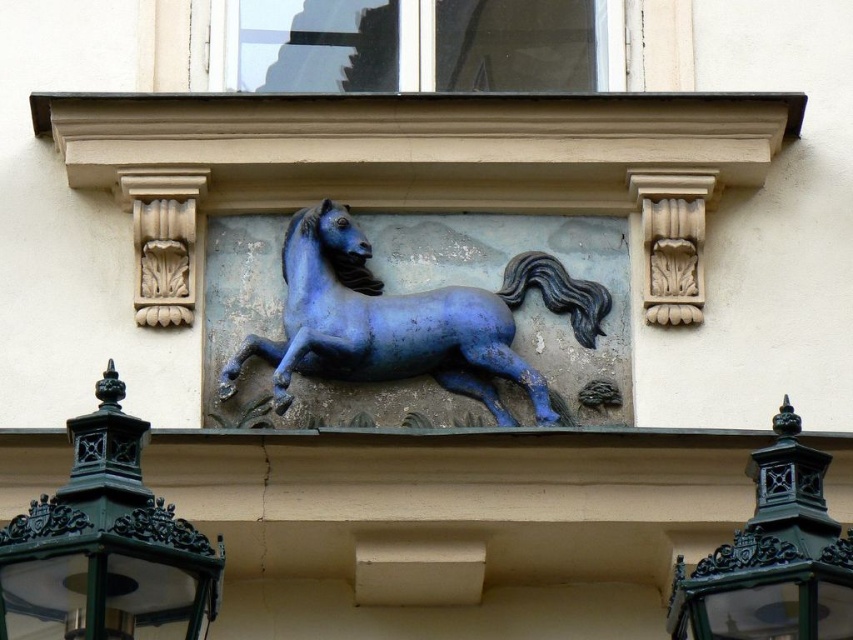
Question: Among these objects, which one is farthest from the camera?

Choices:
 (A) green cast iron lamp at lower left
 (B) glossy blue horse at center

Answer: (B)

Question: Which of the following is the closest to the observer?

Choices:
 (A) glossy blue horse at center
 (B) green cast iron lamp at lower left
 (C) green cast iron lantern at lower right

Answer: (B)

Question: Where is green cast iron lamp at lower left located in relation to green cast iron lantern at lower right in the image?

Choices:
 (A) right
 (B) left

Answer: (B)

Question: Which of the following is the farthest from the observer?

Choices:
 (A) green cast iron lantern at lower right
 (B) glossy blue horse at center

Answer: (B)

Question: Is green cast iron lamp at lower left smaller than green cast iron lantern at lower right?

Choices:
 (A) yes
 (B) no

Answer: (B)

Question: Can you confirm if glossy blue horse at center is thinner than green cast iron lantern at lower right?

Choices:
 (A) yes
 (B) no

Answer: (B)